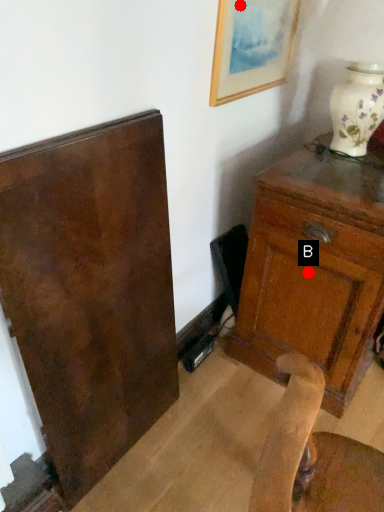
Question: Two points are circled on the image, labeled by A and B beside each circle. Among these points, which one is farthest from the camera?

Choices:
 (A) A is further
 (B) B is further

Answer: (B)